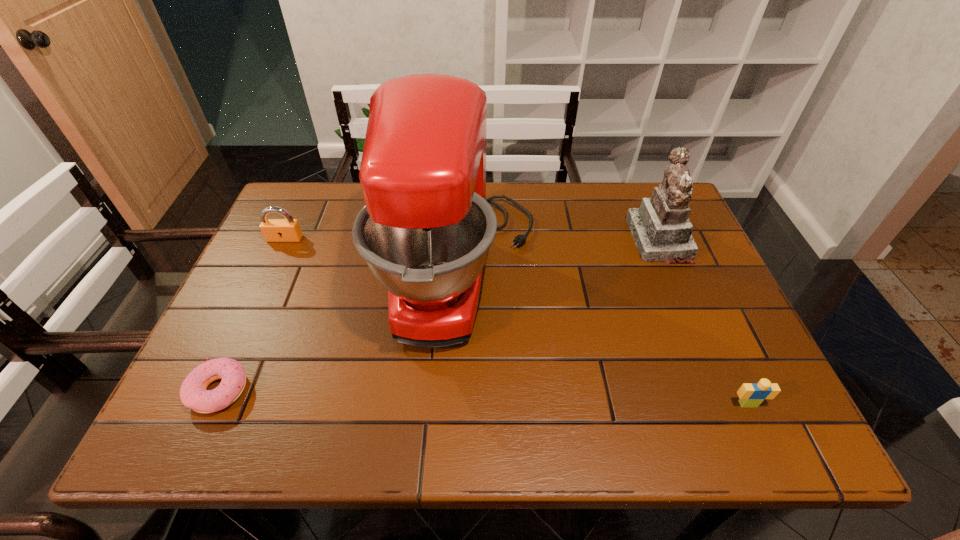
Where is `the tallest object`? The height and width of the screenshot is (540, 960). the tallest object is located at coordinates (425, 231).

Where is `the third object from left to right`? the third object from left to right is located at coordinates (425, 231).

Where is `figurine`? Image resolution: width=960 pixels, height=540 pixels. figurine is located at coordinates (661, 229).

Locate an element on the screen. padlock is located at coordinates (274, 230).

What are the coordinates of `Lego` in the screenshot? It's located at (752, 395).

I want to click on doughnut, so click(x=193, y=393).

This screenshot has height=540, width=960. Identify the location of vacant space located 0.200m on the front-facing side of the third object from left to right. (617, 271).

You are a GUI agent. You are given a task and a screenshot of the screen. Output one action in this format:
    pyautogui.click(x=<x>, y=<y>)
    Task: Click on the free location located on the front-facing side of the figurine
    
    Given the screenshot: What is the action you would take?
    pyautogui.click(x=523, y=240)

You are a GUI agent. You are given a task and a screenshot of the screen. Output one action in this format:
    pyautogui.click(x=<x>, y=<y>)
    Task: Click on the vacant region located on the front-facing side of the figurine
    This screenshot has width=960, height=540.
    Given the screenshot: What is the action you would take?
    pyautogui.click(x=516, y=240)

The width and height of the screenshot is (960, 540). I want to click on free spot located on the front-facing side of the figurine, so click(526, 240).